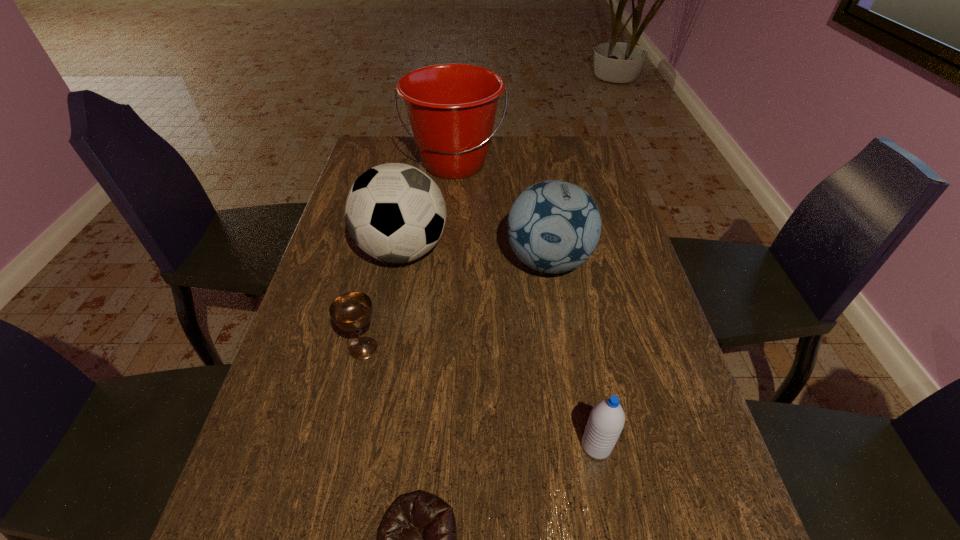
Where is `the farthest object`? This screenshot has width=960, height=540. the farthest object is located at coordinates (451, 107).

Where is `the left soccer ball`? The height and width of the screenshot is (540, 960). the left soccer ball is located at coordinates (394, 212).

Where is `the right soccer ball`? This screenshot has width=960, height=540. the right soccer ball is located at coordinates (554, 226).

This screenshot has height=540, width=960. What are the coordinates of `the second nearest object` in the screenshot? It's located at (606, 421).

At what (x,y) coordinates should I click in order to perform the action: click on water bottle. Please return your answer as a coordinate pair (x, y). This screenshot has width=960, height=540. Looking at the image, I should click on (606, 421).

You are a GUI agent. You are given a task and a screenshot of the screen. Output one action in this format:
    pyautogui.click(x=<x>, y=<y>)
    Task: Click on the chalice
    
    Given the screenshot: What is the action you would take?
    pyautogui.click(x=351, y=311)

Where is `the second shortest object`? The height and width of the screenshot is (540, 960). the second shortest object is located at coordinates (351, 311).

Find the location of a particular element. vacant space located with the handle attached to the rim of the farthest object is located at coordinates (447, 251).

This screenshot has width=960, height=540. In order to click on free space located 0.320m on the main logo of the left soccer ball in this screenshot , I will do `click(564, 251)`.

The image size is (960, 540). I want to click on vacant region located on the side with brand of the right soccer ball, so click(x=567, y=381).